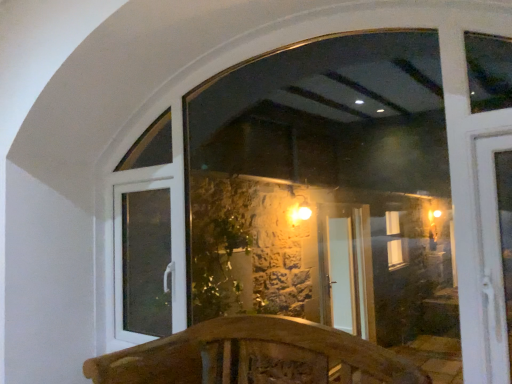
Where is `wooden carved bench at center`? The height and width of the screenshot is (384, 512). wooden carved bench at center is located at coordinates (255, 356).

Locate an element on the screen. The image size is (512, 384). transparent glass window at center is located at coordinates (326, 189).

Is point (115, 320) closer to viewer compared to point (257, 192)?

Yes.

From the image's perspective, is white plastic door at lower left below transparent glass window at center?

Yes.

Can transparent glass window at center be found inside white plastic door at lower left?

No, transparent glass window at center is located outside of white plastic door at lower left.

Based on their sizes in the image, would you say white plastic door at lower left is bigger or smaller than transparent glass window at center?

Clearly, white plastic door at lower left is smaller in size than transparent glass window at center.

Between transparent glass window at center and white plastic door at lower left, which one appears on the right side from the viewer's perspective?

transparent glass window at center is more to the right.

Is transparent glass window at center wider than white plastic door at lower left?

No, transparent glass window at center is not wider than white plastic door at lower left.

Is transparent glass window at center taller or shorter than white plastic door at lower left?

transparent glass window at center is taller than white plastic door at lower left.

Between point (308, 298) and point (162, 286), which one is positioned behind?

Positioned behind is point (308, 298).

From a real-world perspective, is white plastic door at lower left above or below wooden carved bench at center?

white plastic door at lower left is situated higher than wooden carved bench at center in the real world.

Looking at this image, from the image's perspective, which object appears higher, white plastic door at lower left or wooden carved bench at center?

white plastic door at lower left.

Is white plastic door at lower left oriented towards wooden carved bench at center?

No, white plastic door at lower left is not oriented towards wooden carved bench at center.

Between white plastic door at lower left and wooden carved bench at center, which one has smaller size?

Smaller between the two is white plastic door at lower left.

In the scene shown: Can you see wooden carved bench at center touching white plastic door at lower left?

No, wooden carved bench at center is not next to white plastic door at lower left.

Does point (237, 362) come in front of point (155, 216)?

Yes.

Which object is thinner, wooden carved bench at center or white plastic door at lower left?

white plastic door at lower left.

Is wooden carved bench at center turned away from white plastic door at lower left?

That's not correct — wooden carved bench at center is not looking away from white plastic door at lower left.

Based on their sizes in the image, would you say transparent glass window at center is bigger or smaller than wooden carved bench at center?

Considering their sizes, transparent glass window at center takes up less space than wooden carved bench at center.

Is the position of transparent glass window at center less distant than that of wooden carved bench at center?

That is False.

Does transparent glass window at center have a greater width compared to wooden carved bench at center?

No.

From the image's perspective, is transparent glass window at center above or below wooden carved bench at center?

Based on their image positions, transparent glass window at center is located above wooden carved bench at center.

From a real-world perspective, who is located lower, wooden carved bench at center or transparent glass window at center?

In real-world perspective, wooden carved bench at center is lower.

How many degrees apart are the facing directions of wooden carved bench at center and transparent glass window at center?

1.57 degrees.

Which object is thinner, wooden carved bench at center or transparent glass window at center?

transparent glass window at center is thinner.

Can you confirm if wooden carved bench at center is smaller than transparent glass window at center?

Actually, wooden carved bench at center might be larger than transparent glass window at center.

Where is `window screen in front of the white plastic door at lower left`? The width and height of the screenshot is (512, 384). window screen in front of the white plastic door at lower left is located at coordinates (326, 189).

Identify the location of window screen on the right of white plastic door at lower left. (326, 189).

From the image, which object appears to be nearer to wooden carved bench at center, transparent glass window at center or white plastic door at lower left?

white plastic door at lower left is positioned closer to the anchor wooden carved bench at center.

Based on the photo, considering their positions, is white plastic door at lower left positioned closer to wooden carved bench at center than transparent glass window at center?

The object closer to wooden carved bench at center is white plastic door at lower left.

Estimate the real-world distances between objects in this image. Which object is further from transparent glass window at center, white plastic door at lower left or wooden carved bench at center?

Based on the image, wooden carved bench at center appears to be further to transparent glass window at center.

Looking at the image, which one is located closer to white plastic door at lower left, transparent glass window at center or wooden carved bench at center?

Based on the image, wooden carved bench at center appears to be nearer to white plastic door at lower left.

Estimate the real-world distances between objects in this image. Which object is further from transparent glass window at center, wooden carved bench at center or white plastic door at lower left?

wooden carved bench at center lies further to transparent glass window at center than the other object.

From the image, which object appears to be farther from white plastic door at lower left, wooden carved bench at center or transparent glass window at center?

transparent glass window at center is further to white plastic door at lower left.

The image size is (512, 384). Identify the location of window screen between wooden carved bench at center and white plastic door at lower left from front to back. (326, 189).